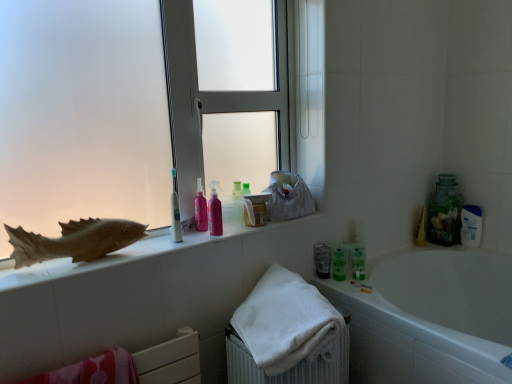
Question: Can you confirm if white glossy bathtub at lower right is shorter than pink glossy lotion at center, which is counted as the 2th toiletry, starting from the bottom?

Choices:
 (A) no
 (B) yes

Answer: (A)

Question: Can you confirm if white glossy bathtub at lower right is positioned to the right of pink glossy lotion at center, arranged as the first toiletry when viewed from the front?

Choices:
 (A) yes
 (B) no

Answer: (A)

Question: Does white glossy bathtub at lower right have a greater width compared to pink glossy lotion at center, the 2th toiletry from the right?

Choices:
 (A) no
 (B) yes

Answer: (B)

Question: Is the surface of white glossy bathtub at lower right in direct contact with pink glossy lotion at center, which appears as the first toiletry when viewed from the top?

Choices:
 (A) no
 (B) yes

Answer: (A)

Question: Does white glossy bathtub at lower right have a larger size compared to pink glossy lotion at center, which is counted as the 2th toiletry, starting from the bottom?

Choices:
 (A) no
 (B) yes

Answer: (B)

Question: From the image's perspective, would you say white glossy bathtub at lower right is positioned over pink glossy lotion at center, which appears as the first toiletry when viewed from the top?

Choices:
 (A) yes
 (B) no

Answer: (B)

Question: Is green translucent bottle at lower center, acting as the 1th toiletry starting from the back, oriented towards clear glass jar at upper right?

Choices:
 (A) yes
 (B) no

Answer: (B)

Question: Can you confirm if green translucent bottle at lower center, which is the 2th toiletry from top to bottom, is positioned to the left of clear glass jar at upper right?

Choices:
 (A) no
 (B) yes

Answer: (B)

Question: Is the position of green translucent bottle at lower center, the 2th toiletry from the left, more distant than that of clear glass jar at upper right?

Choices:
 (A) no
 (B) yes

Answer: (A)

Question: Is green translucent bottle at lower center, placed as the first toiletry when sorted from right to left, next to clear glass jar at upper right?

Choices:
 (A) no
 (B) yes

Answer: (A)

Question: Is green translucent bottle at lower center, which is the 2th toiletry from top to bottom, positioned with its back to clear glass jar at upper right?

Choices:
 (A) yes
 (B) no

Answer: (B)

Question: From a real-world perspective, is pink glossy lotion at center, the 1th toiletry when ordered from left to right, beneath clear glass jar at upper right?

Choices:
 (A) no
 (B) yes

Answer: (A)